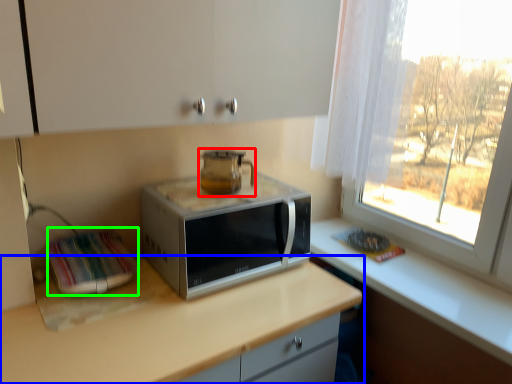
Question: Which object is positioned farthest from home appliance (highlighted by a red box)? Select from countertop (highlighted by a blue box) and appliance (highlighted by a green box).

Choices:
 (A) countertop
 (B) appliance

Answer: (A)